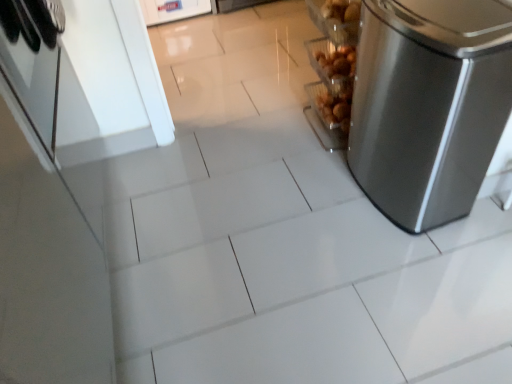
The image size is (512, 384). Describe the element at coordinates (429, 105) in the screenshot. I see `satin silver trash can at right` at that location.

Measure the distance between point (468, 147) and camera.

Point (468, 147) and camera are 1.60 meters apart.

Where is `satin silver trash can at right`? The height and width of the screenshot is (384, 512). satin silver trash can at right is located at coordinates (429, 105).

Where is `satin silver trash can at right`? This screenshot has width=512, height=384. satin silver trash can at right is located at coordinates (429, 105).